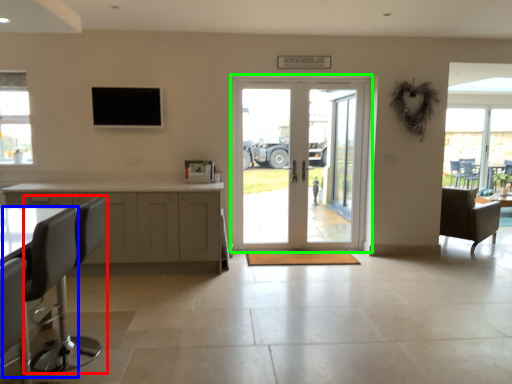
Question: Which object is positioned closest to chair (highlighted by a red box)? Select from swivel chair (highlighted by a blue box) and door (highlighted by a green box).

Choices:
 (A) swivel chair
 (B) door

Answer: (A)